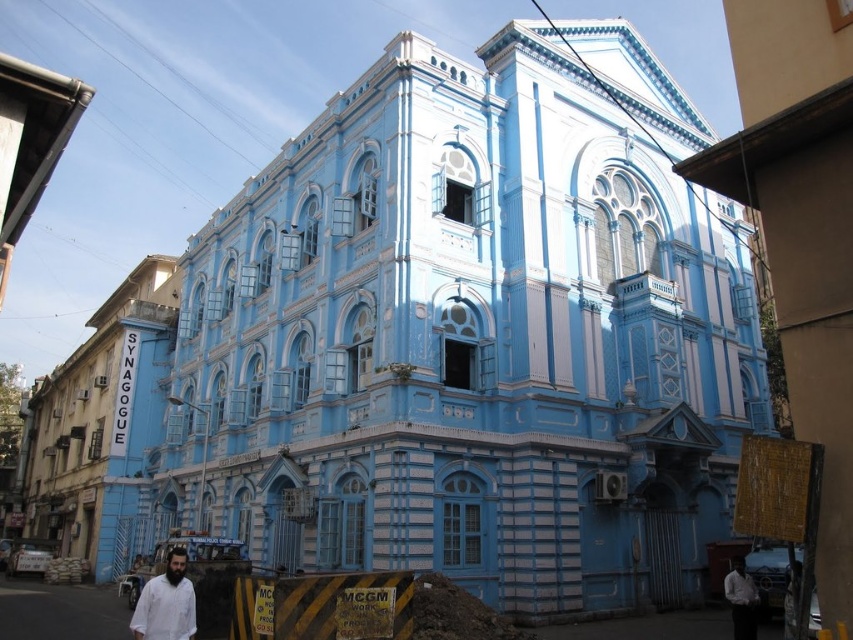
Is white matte shirt at lower left further to the viewer compared to white shirt at lower right?

No, white matte shirt at lower left is closer to the viewer.

What do you see at coordinates (166, 604) in the screenshot?
I see `white matte shirt at lower left` at bounding box center [166, 604].

This screenshot has width=853, height=640. Identify the location of white matte shirt at lower left. (166, 604).